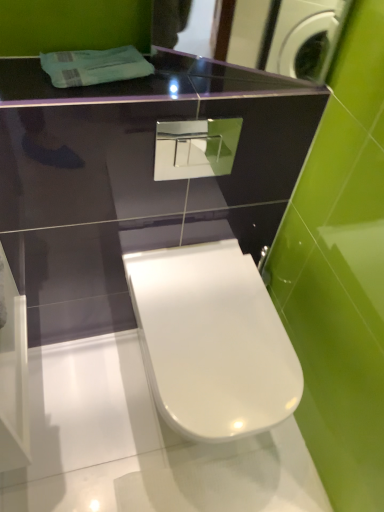
Question: Is white glossy toilet at center to the left or to the right of glossy black mirror at upper center in the image?

Choices:
 (A) right
 (B) left

Answer: (B)

Question: Considering their positions, is white glossy toilet at center located in front of or behind glossy black mirror at upper center?

Choices:
 (A) behind
 (B) front

Answer: (A)

Question: From their relative heights in the image, would you say white glossy toilet at center is taller or shorter than glossy black mirror at upper center?

Choices:
 (A) tall
 (B) short

Answer: (A)

Question: In the image, is glossy black mirror at upper center on the left side or the right side of white glossy toilet at center?

Choices:
 (A) right
 (B) left

Answer: (A)

Question: From a real-world perspective, relative to white glossy toilet at center, is glossy black mirror at upper center vertically above or below?

Choices:
 (A) below
 (B) above

Answer: (B)

Question: From the image's perspective, is glossy black mirror at upper center located above or below white glossy toilet at center?

Choices:
 (A) below
 (B) above

Answer: (B)

Question: From their relative heights in the image, would you say glossy black mirror at upper center is taller or shorter than white glossy toilet at center?

Choices:
 (A) tall
 (B) short

Answer: (B)